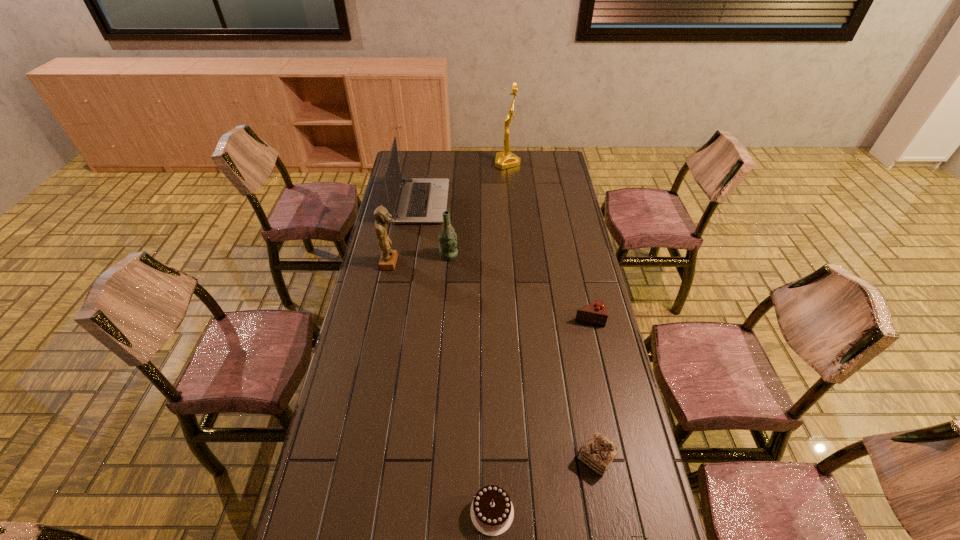
Image resolution: width=960 pixels, height=540 pixels. I want to click on laptop computer that is at the left edge, so [419, 200].

This screenshot has width=960, height=540. I want to click on vacant space at the far edge, so click(461, 151).

Identify the location of vacant area at the left edge. This screenshot has height=540, width=960. (356, 392).

Where is `free region at the right edge of the desktop`? This screenshot has height=540, width=960. free region at the right edge of the desktop is located at coordinates (631, 502).

In the image, there is a desktop. Identify the location of vacant space at the far right corner. This screenshot has width=960, height=540. (539, 166).

Where is `empty space that is in between the figurine and the farthest chocolate cake`? The height and width of the screenshot is (540, 960). empty space that is in between the figurine and the farthest chocolate cake is located at coordinates (490, 291).

I want to click on vacant area between the leftmost chocolate cake and the award, so click(500, 338).

At what (x,y) coordinates should I click in order to perform the action: click on free space that is in between the farthest chocolate cake and the figurine. Please return your answer as a coordinate pair (x, y). Looking at the image, I should click on pyautogui.click(x=490, y=291).

What are the coordinates of `vacant region between the laptop computer and the beer bottle` in the screenshot? It's located at (435, 229).

I want to click on free spot between the beer bottle and the fourth nearest object, so click(x=519, y=287).